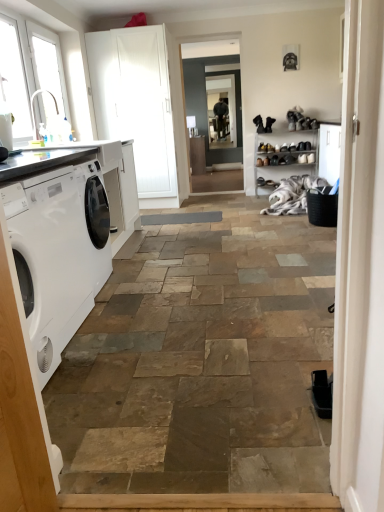
Question: Is white glass window at upper left, which appears as the first window when viewed from the back, further to the viewer compared to white matte screen door at upper left, the 2th screen door from the right?

Choices:
 (A) yes
 (B) no

Answer: (B)

Question: Is white glass window at upper left, which appears as the first window when viewed from the back, positioned in front of white matte screen door at upper left, arranged as the first screen door when viewed from the left?

Choices:
 (A) yes
 (B) no

Answer: (A)

Question: From a real-world perspective, is white glass window at upper left, which appears as the first window when viewed from the back, positioned under white matte screen door at upper left, the 2th screen door from the right, based on gravity?

Choices:
 (A) no
 (B) yes

Answer: (A)

Question: Would you say white glass window at upper left, which appears as the first window when viewed from the back, is outside white matte screen door at upper left, arranged as the first screen door when viewed from the left?

Choices:
 (A) yes
 (B) no

Answer: (A)

Question: Is white glass window at upper left, which is counted as the 2th window, starting from the front, directly adjacent to white matte screen door at upper left, arranged as the first screen door when viewed from the left?

Choices:
 (A) yes
 (B) no

Answer: (B)

Question: Is point (223, 131) closer or farther from the camera than point (302, 156)?

Choices:
 (A) closer
 (B) farther

Answer: (B)

Question: Considering the positions of clear glass window screen at center and black leather shoe at center in the image, is clear glass window screen at center wider or thinner than black leather shoe at center?

Choices:
 (A) wide
 (B) thin

Answer: (B)

Question: Considering the relative positions of clear glass window screen at center and black leather shoe at center in the image provided, is clear glass window screen at center to the left or to the right of black leather shoe at center?

Choices:
 (A) left
 (B) right

Answer: (A)

Question: From the image's perspective, is clear glass window screen at center located above or below black leather shoe at center?

Choices:
 (A) above
 (B) below

Answer: (A)

Question: From a real-world perspective, relative to white plastic window at upper left, which is the second window from back to front, is white fluffy laundry at center vertically above or below?

Choices:
 (A) above
 (B) below

Answer: (B)

Question: Based on their positions, is white fluffy laundry at center located to the left or right of white plastic window at upper left, placed as the 1th window when sorted from front to back?

Choices:
 (A) right
 (B) left

Answer: (A)

Question: Is white fluffy laundry at center spatially inside white plastic window at upper left, placed as the 1th window when sorted from front to back, or outside of it?

Choices:
 (A) outside
 (B) inside

Answer: (A)

Question: Considering the positions of white fluffy laundry at center and white plastic window at upper left, placed as the 1th window when sorted from front to back, in the image, is white fluffy laundry at center wider or thinner than white plastic window at upper left, placed as the 1th window when sorted from front to back,?

Choices:
 (A) wide
 (B) thin

Answer: (A)

Question: Does point (11, 90) appear closer or farther from the camera than point (218, 98)?

Choices:
 (A) closer
 (B) farther

Answer: (A)

Question: From a real-world perspective, relative to clear glass window screen at center, is white plastic window at upper left, placed as the 1th window when sorted from front to back, vertically above or below?

Choices:
 (A) above
 (B) below

Answer: (A)